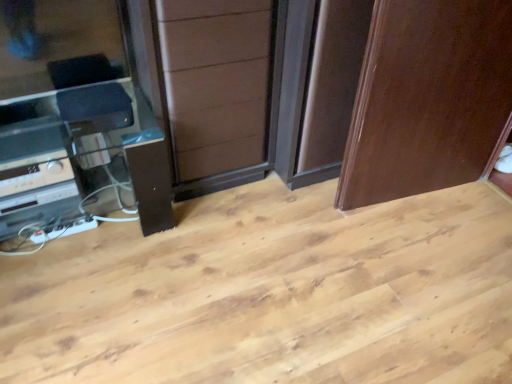
Identify the location of free region under glossy wood door at upper right (from a real-world perspective). Image resolution: width=512 pixels, height=384 pixels. (415, 195).